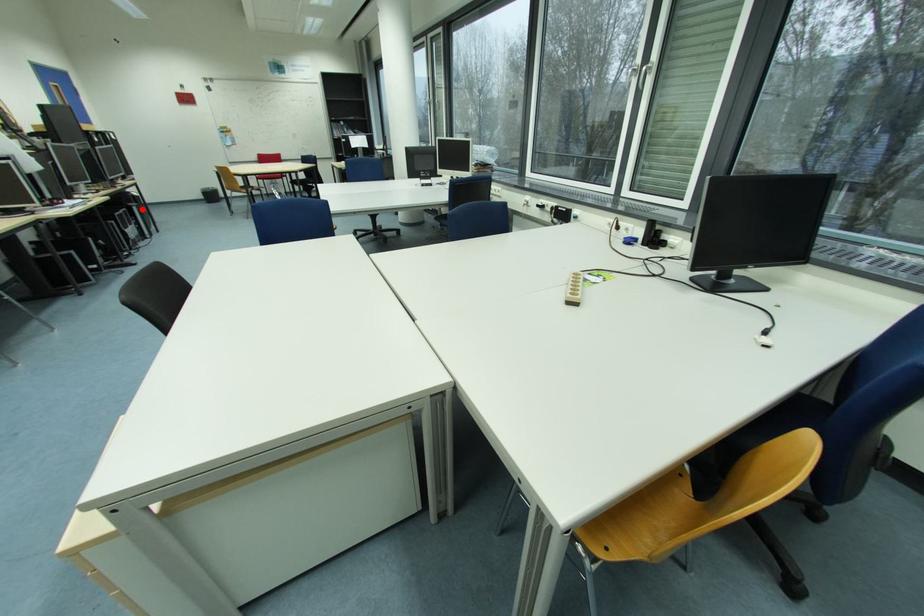
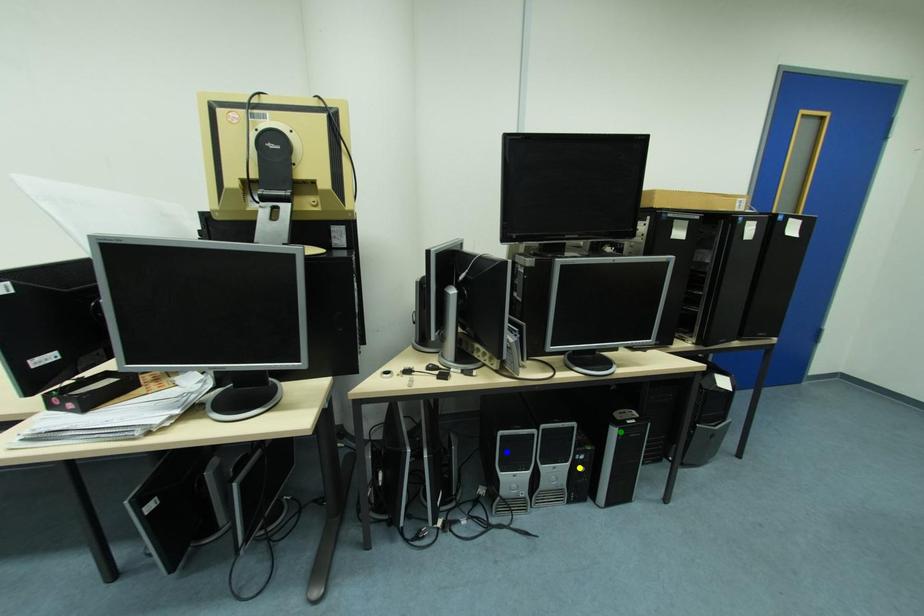
Question: I am providing you with two images of the same scene from different viewpoints. A red point is marked on the first image. You are given multiple points on the second image. Can you choose the point in image 2 that corresponds to the point in image 1?

Choices:
 (A) blue point
 (B) green point
 (C) yellow point

Answer: (B)